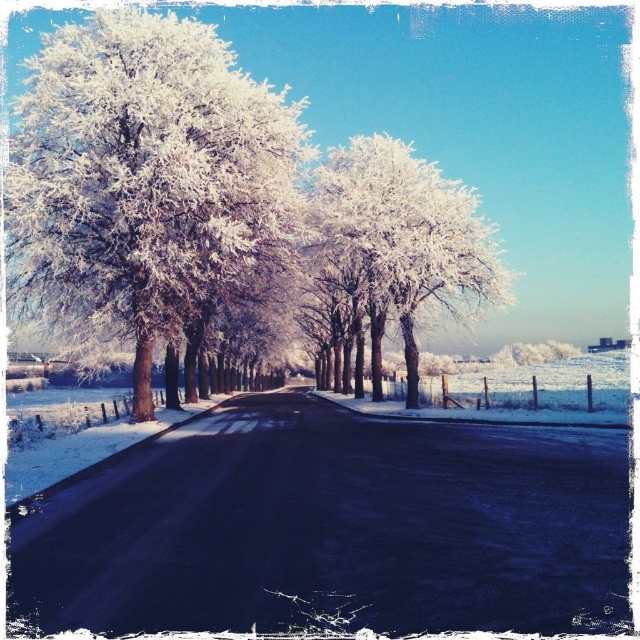
Which is below, frosted white tree at left or white frosty tree at center?

Positioned lower is white frosty tree at center.

Is frosted white tree at left to the right of white frosty tree at center from the viewer's perspective?

Incorrect, frosted white tree at left is not on the right side of white frosty tree at center.

Identify the location of frosted white tree at left. The width and height of the screenshot is (640, 640). (145, 180).